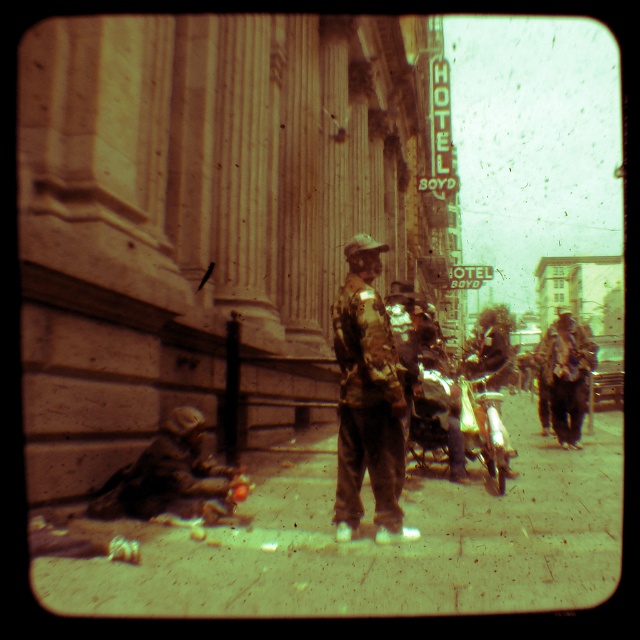
Question: Which object is closer to the camera taking this photo?

Choices:
 (A) smooth concrete sidewalk at lower left
 (B) shiny chrome motorcycle at center
 (C) camouflage fabric jacket at center
 (D) brown cardboard figure at lower left

Answer: (A)

Question: Which point is closer to the camera taking this photo?

Choices:
 (A) (150, 445)
 (B) (384, 524)
 (C) (470, 454)

Answer: (B)

Question: Can you confirm if smooth concrete sidewalk at lower left is positioned to the left of shiny chrome motorcycle at center?

Choices:
 (A) no
 (B) yes

Answer: (B)

Question: Which of the following is the farthest from the observer?

Choices:
 (A) (189, 548)
 (B) (109, 481)
 (C) (392, 499)
 (D) (484, 433)

Answer: (D)

Question: Does shiny chrome motorcycle at center appear under brown leather jacket at center?

Choices:
 (A) no
 (B) yes

Answer: (A)

Question: Can you confirm if camouflage fabric jacket at center is positioned below shiny chrome motorcycle at center?

Choices:
 (A) no
 (B) yes

Answer: (A)